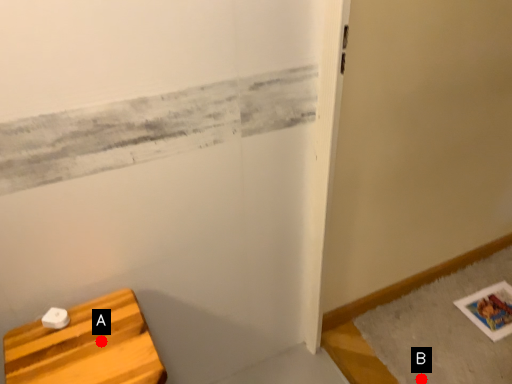
Question: Two points are circled on the image, labeled by A and B beside each circle. Which point is closer to the camera taking this photo?

Choices:
 (A) A is closer
 (B) B is closer

Answer: (A)